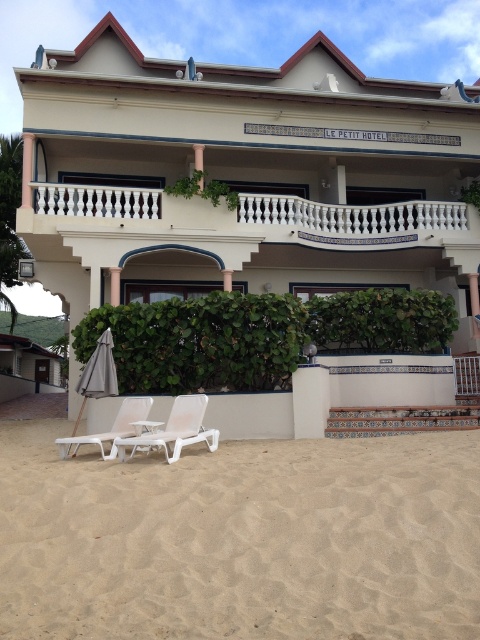
The image size is (480, 640). What do you see at coordinates (243, 177) in the screenshot? I see `white matte building at center` at bounding box center [243, 177].

Does white matte building at center appear on the right side of white plastic beach chair at lower center?

Indeed, white matte building at center is positioned on the right side of white plastic beach chair at lower center.

What are the coordinates of `white matte building at center` in the screenshot? It's located at (243, 177).

Is white balustrade at upper center taller than white plastic chair at lower left?

Yes.

Is point (238, 208) positioned in front of point (66, 445)?

No, (238, 208) is behind (66, 445).

This screenshot has width=480, height=640. I want to click on white balustrade at upper center, so click(x=264, y=214).

What do you see at coordinates (97, 374) in the screenshot? I see `gray fabric umbrella at lower left` at bounding box center [97, 374].

Is point (100, 381) positioned in front of point (136, 413)?

No, it is not.

At what (x,y) coordinates should I click in order to perform the action: click on gray fabric umbrella at lower left. Please return your answer as a coordinate pair (x, y). Image resolution: width=480 pixels, height=640 pixels. Looking at the image, I should click on (97, 374).